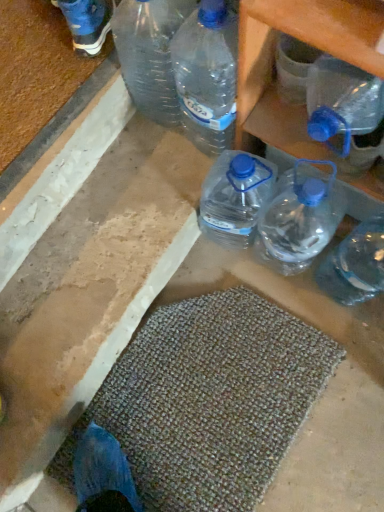
Question: Is textured beige bath mat at lower center in front of or behind transparent plastic bottle at upper right, the second bottle in the back-to-front sequence, in the image?

Choices:
 (A) behind
 (B) front

Answer: (A)

Question: From their relative heights in the image, would you say textured beige bath mat at lower center is taller or shorter than transparent plastic bottle at upper right, which is the 1th bottle in front-to-back order?

Choices:
 (A) tall
 (B) short

Answer: (B)

Question: Which of these objects is positioned closest to the transparent plastic bottle at upper right, the second bottle in the back-to-front sequence?

Choices:
 (A) textured beige bath mat at lower center
 (B) transparent plastic bottle at right, the first bottle viewed from the back
 (C) transparent plastic bottles at upper right

Answer: (C)

Question: Estimate the real-world distances between objects in this image. Which object is closer to the textured beige bath mat at lower center?

Choices:
 (A) transparent plastic bottle at upper right, the second bottle in the back-to-front sequence
 (B) transparent plastic bottle at right, the second bottle in the front-to-back sequence
 (C) transparent plastic bottles at upper right

Answer: (B)